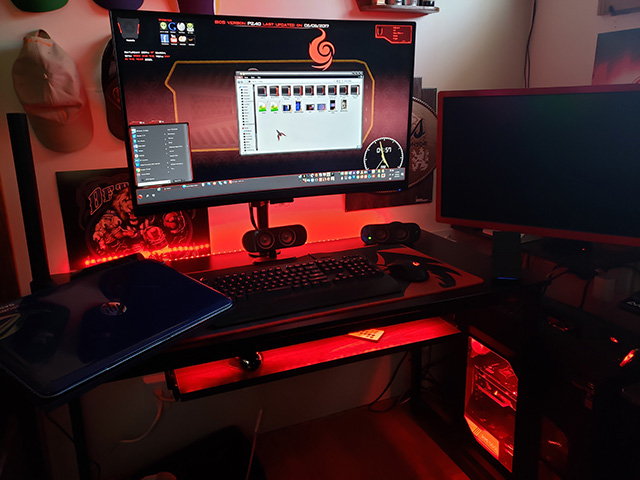
At what (x,y) coordinates should I click in order to perform the action: click on laptop. Please return your answer as a coordinate pair (x, y). The height and width of the screenshot is (480, 640). Looking at the image, I should click on (104, 339).